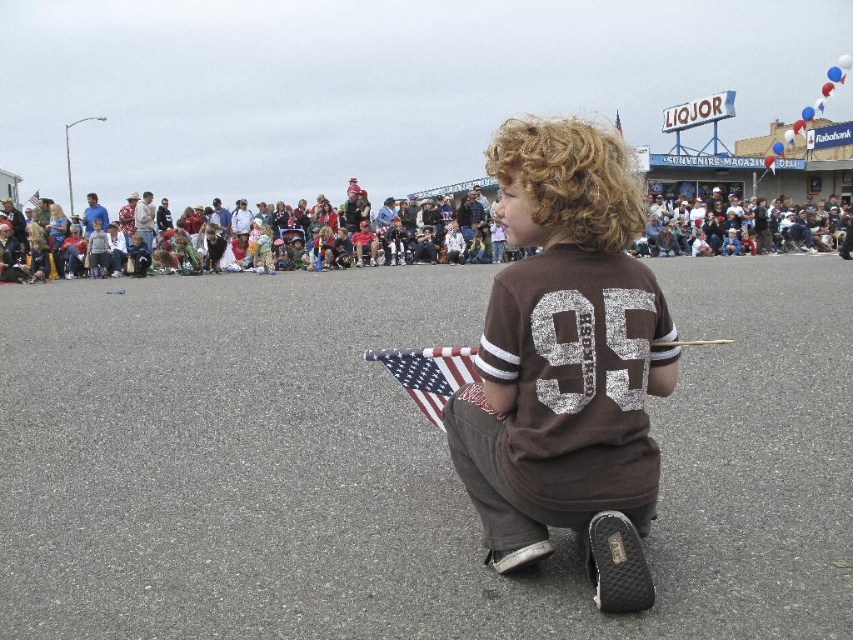
Question: Among these points, which one is farthest from the camera?

Choices:
 (A) (434, 380)
 (B) (518, 472)
 (C) (659, 220)

Answer: (C)

Question: Can you confirm if brown jersey at center is positioned to the right of american flag at center?

Choices:
 (A) no
 (B) yes

Answer: (B)

Question: In this image, where is brown jersey at center located relative to american flag at center?

Choices:
 (A) left
 (B) right

Answer: (B)

Question: Where is brown jersey at center located in relation to multicolored fabric crowd at center in the image?

Choices:
 (A) left
 (B) right

Answer: (A)

Question: Which point appears farthest from the camera in this image?

Choices:
 (A) (573, 436)
 (B) (439, 368)
 (C) (670, 253)

Answer: (C)

Question: Which point is closer to the camera taking this photo?

Choices:
 (A) (440, 372)
 (B) (624, 164)

Answer: (B)